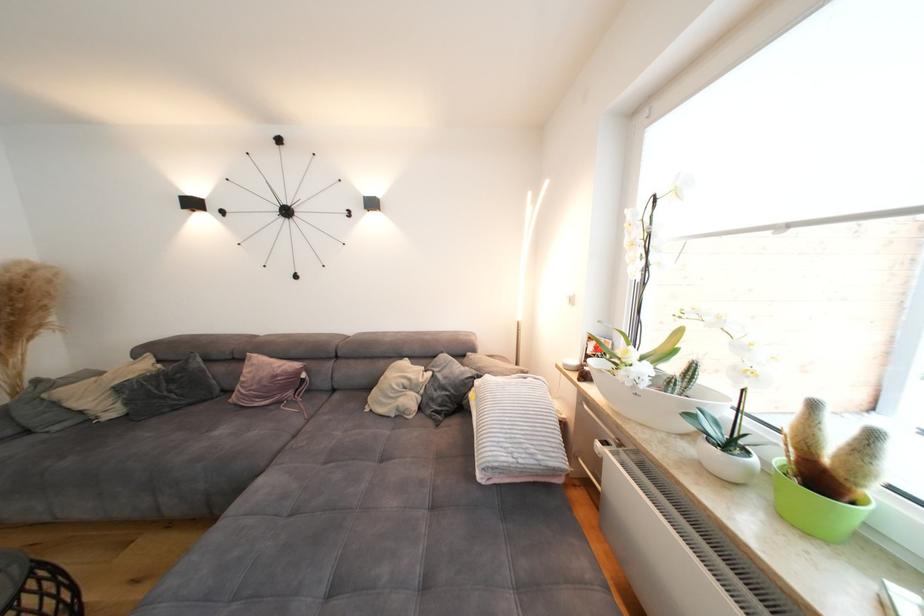
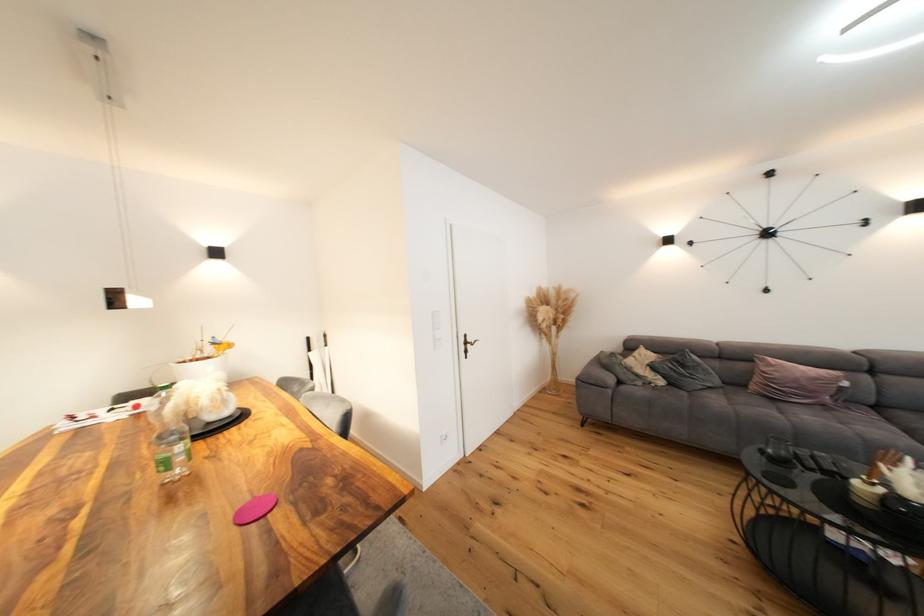
Find the pixel in the second image that matches point 209,408 in the first image.

(727, 392)